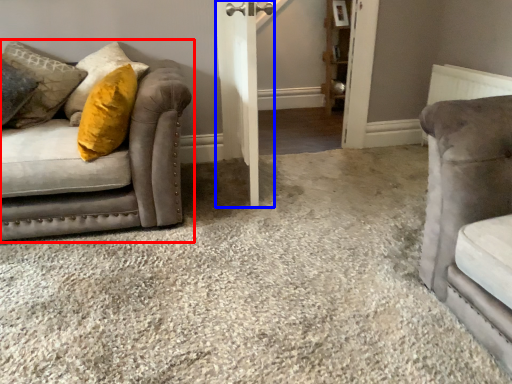
Question: Which of the following is the farthest to the observer, studio couch (highlighted by a red box) or barn door (highlighted by a blue box)?

Choices:
 (A) studio couch
 (B) barn door

Answer: (B)